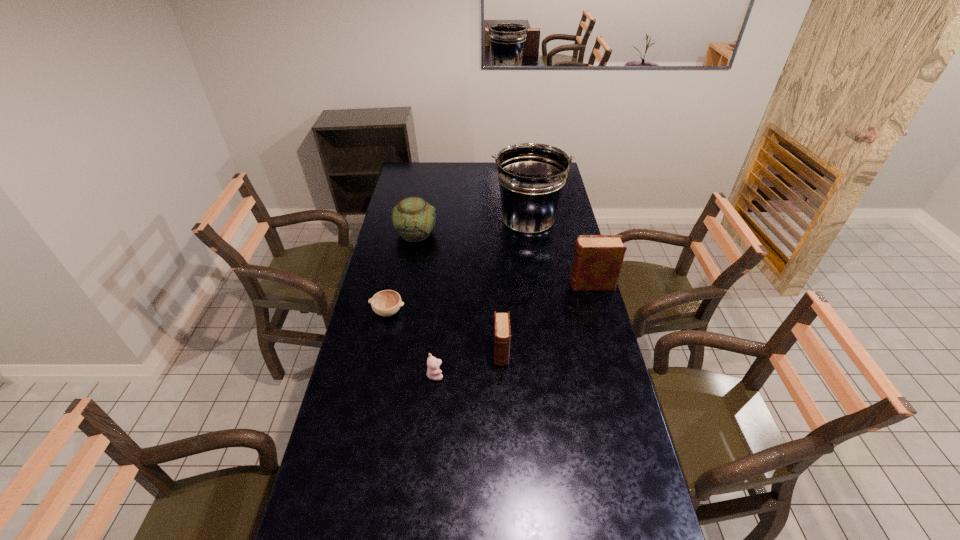
Please show where to add a diary on the left while keeping spacing even. Please provide its 2D coordinates. Your answer should be formatted as a tuple, i.e. [(x, y)], where the tuple contains the x and y coordinates of a point satisfying the conditions above.

[(375, 449)]